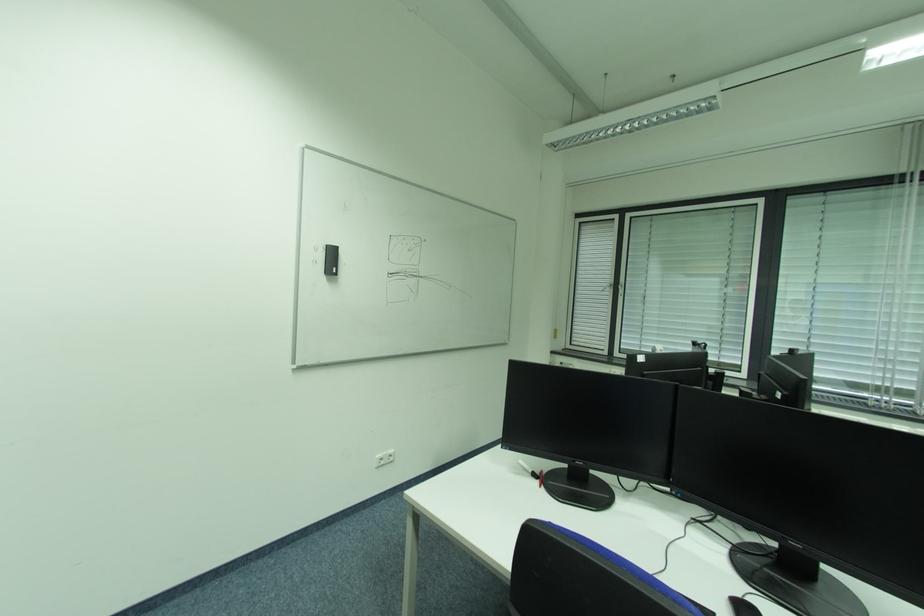
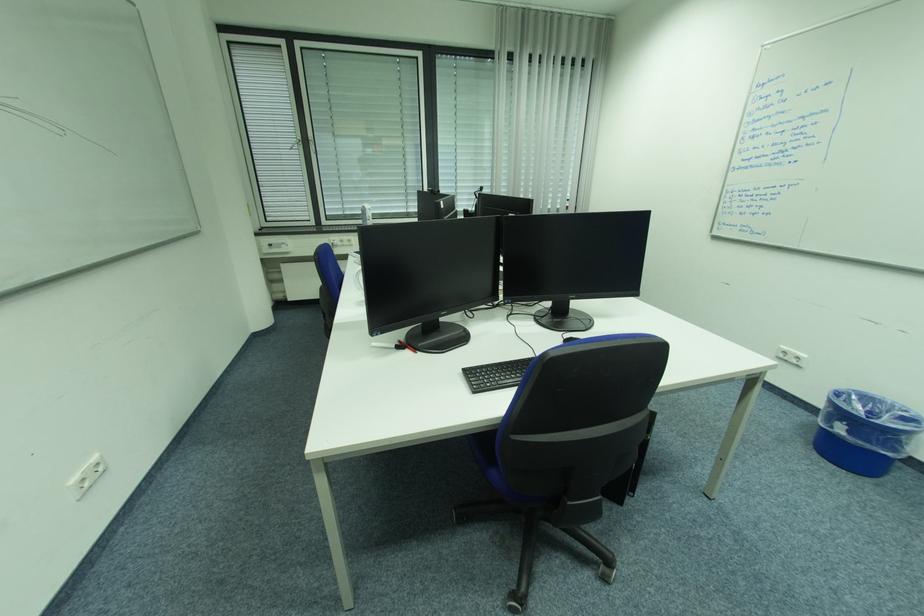
The first image is from the beginning of the video and the second image is from the end. How did the camera likely rotate when shooting the video?

The rotation direction of the camera is right-down.